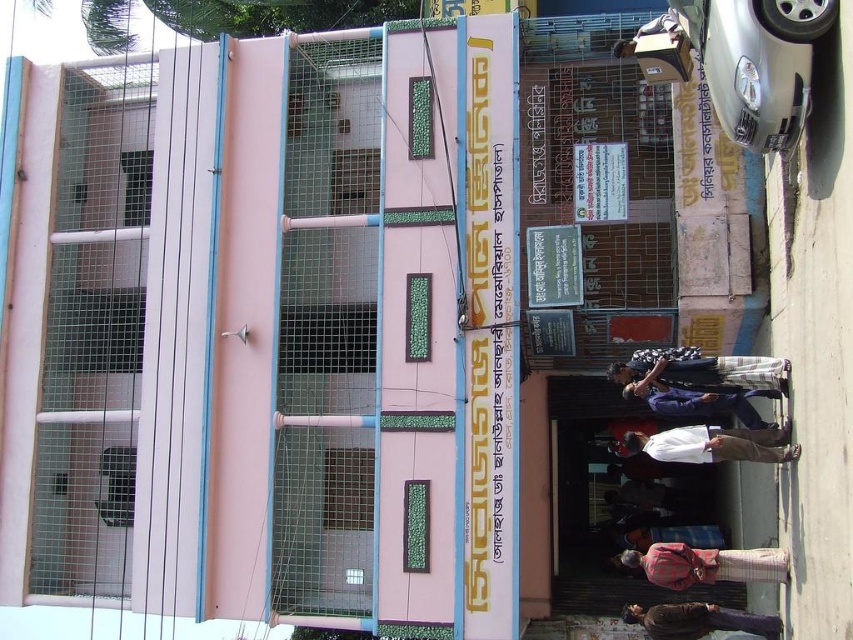
You are standing at point [695,28] and want to enter the building. The entrance is 43.92 feet away. Is the entrance within a 50 feet walking distance?

The entrance is 43.92 feet away from point [695,28], so yes, it is within 50 feet walking distance.